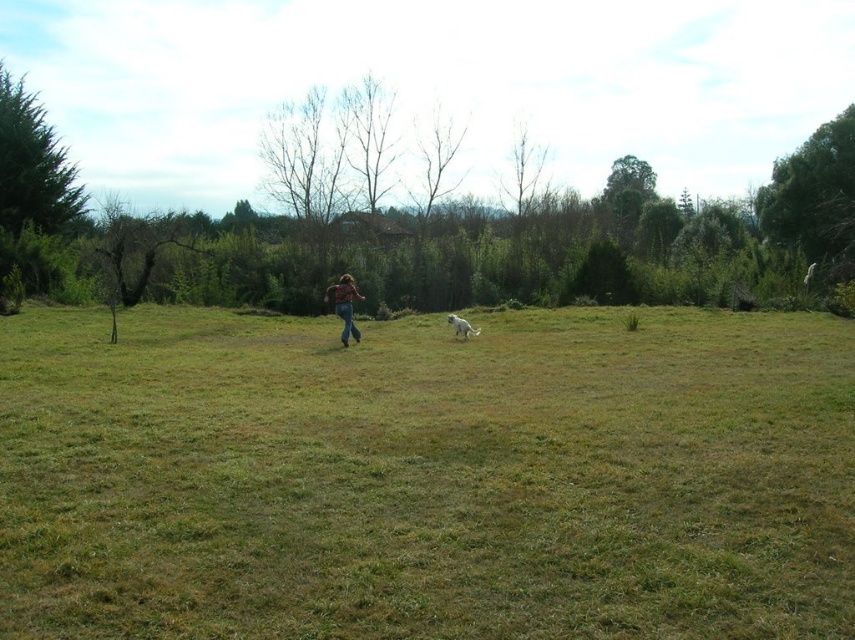
You are standing at the origin point in the image. Which direction should you walk to reach the green grass at center?

The green grass at center is located at point (x=426, y=476), so you should walk towards the right and slightly forward to reach it.

You are a photographer standing in the grassy field. You want to take a photo that includes both point A at point (348,276) and point B at point (461,333). Which point is closer to you, the photographer?

Point A at point (348,276) is closer to the photographer than point B at point (461,333).